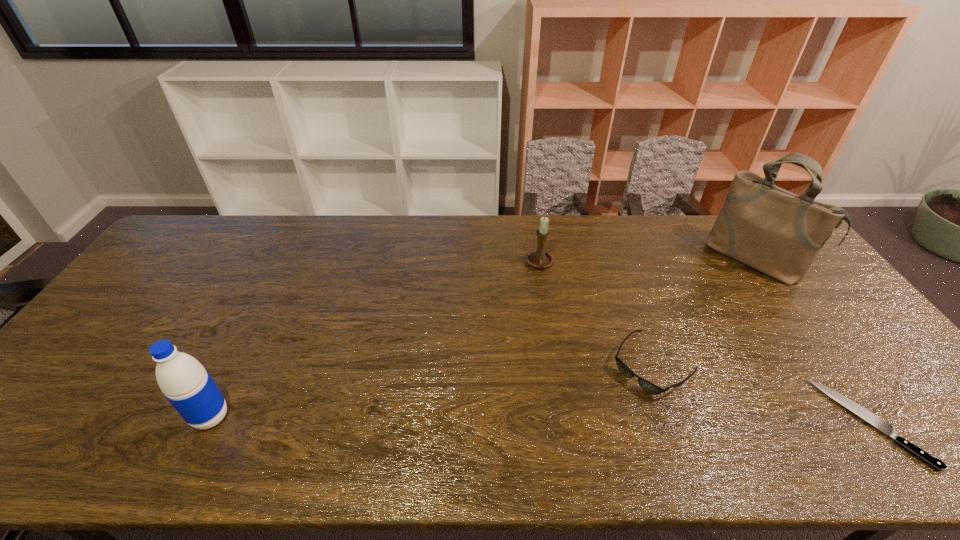
Where is `blank space located 0.070m on the front-facing side of the sunglasses`? The width and height of the screenshot is (960, 540). blank space located 0.070m on the front-facing side of the sunglasses is located at coordinates (612, 405).

You are a GUI agent. You are given a task and a screenshot of the screen. Output one action in this format:
    pyautogui.click(x=<x>, y=<y>)
    Task: Click on the free space located 0.130m on the front-facing side of the sunglasses
    This screenshot has height=540, width=960.
    Given the screenshot: What is the action you would take?
    pyautogui.click(x=597, y=421)

Where is `free location located on the side of the fourth object from right to left with the handle`? The height and width of the screenshot is (540, 960). free location located on the side of the fourth object from right to left with the handle is located at coordinates (519, 358).

The height and width of the screenshot is (540, 960). What are the coordinates of `blank area located on the side of the fourth object from right to left with the handle` in the screenshot? It's located at (520, 352).

Locate an element on the screen. This screenshot has height=540, width=960. free space located on the side of the fourth object from right to left with the handle is located at coordinates click(521, 349).

At what (x,y) coordinates should I click in order to perform the action: click on vacant space located 0.170m on the front-facing side of the tallest object. Please return your answer as a coordinate pair (x, y). The image size is (960, 540). Looking at the image, I should click on (713, 307).

You are a GUI agent. You are given a task and a screenshot of the screen. Output one action in this format:
    pyautogui.click(x=<x>, y=<y>)
    Task: Click on the blank space located on the front-facing side of the tallest object
    
    Given the screenshot: What is the action you would take?
    pyautogui.click(x=694, y=328)

Locate an element on the screen. vacant space situated on the front-facing side of the tallest object is located at coordinates (706, 315).

Identify the location of candle holder that is positioned at the far edge. (539, 258).

This screenshot has width=960, height=540. I want to click on shoulder bag positioned at the far edge, so click(x=779, y=233).